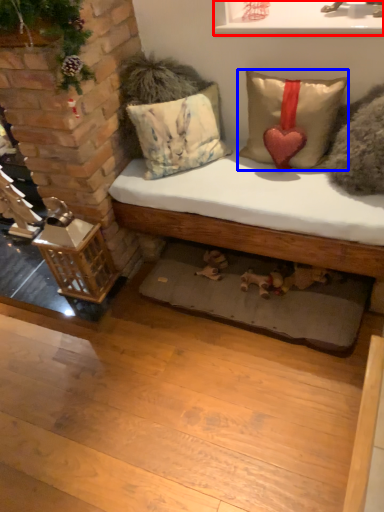
Question: Which point is closer to the camera, window sill (highlighted by a red box) or pillow (highlighted by a blue box)?

Choices:
 (A) window sill
 (B) pillow

Answer: (A)